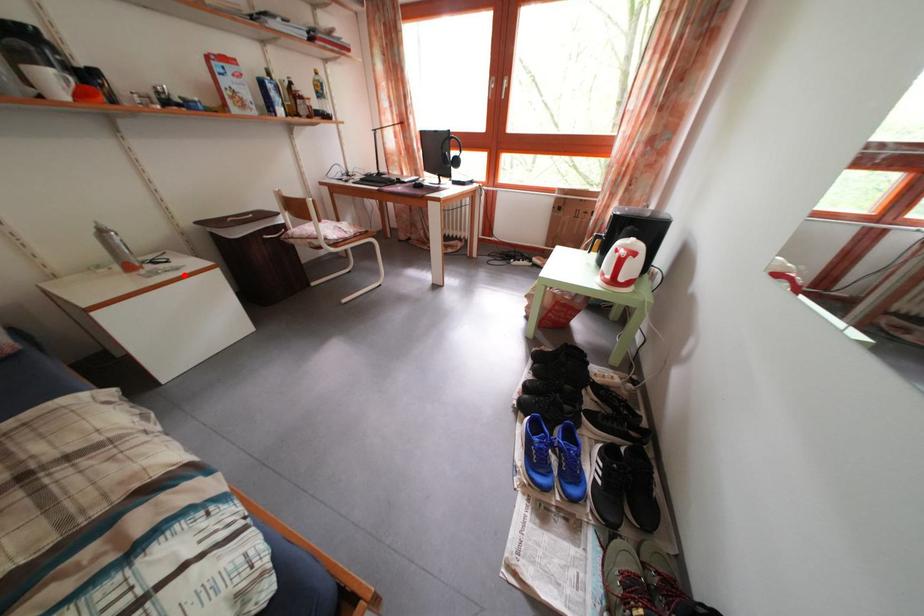
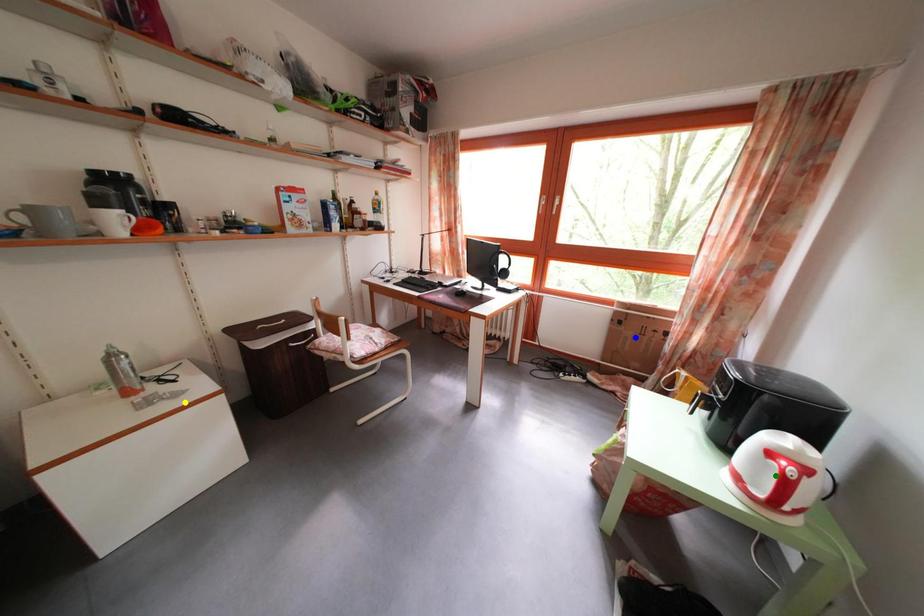
Question: I am providing you with two images of the same scene from different viewpoints. A red point is marked on the first image. You are given multiple points on the second image. Which point in image 2 is actually the same real-world point as the red point in image 1?

Choices:
 (A) blue point
 (B) green point
 (C) yellow point

Answer: (C)